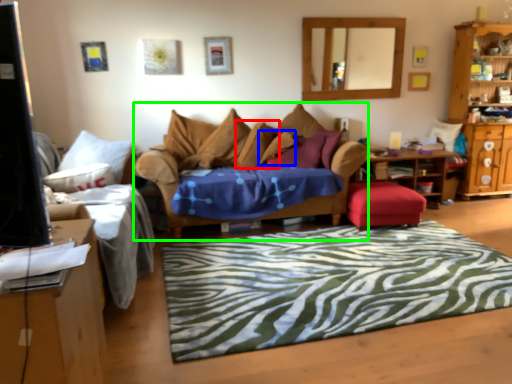
Question: Which object is the farthest from pillow (highlighted by a red box)? Choose among these: pillow (highlighted by a blue box) or studio couch (highlighted by a green box).

Choices:
 (A) pillow
 (B) studio couch

Answer: (B)